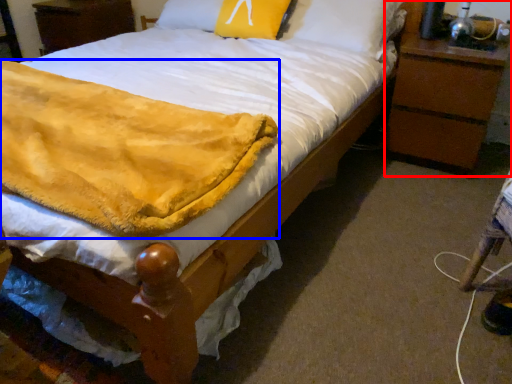
Question: Which point is further to the camera, nightstand (highlighted by a red box) or blanket (highlighted by a blue box)?

Choices:
 (A) nightstand
 (B) blanket

Answer: (A)